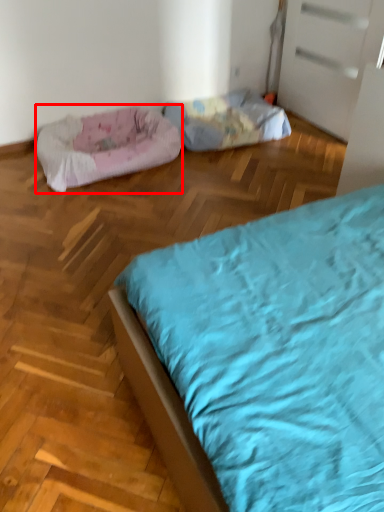
Question: Considering the relative positions of dog bed (annotated by the red box) and dog bed in the image provided, where is dog bed (annotated by the red box) located with respect to the staircase?

Choices:
 (A) left
 (B) right

Answer: (A)